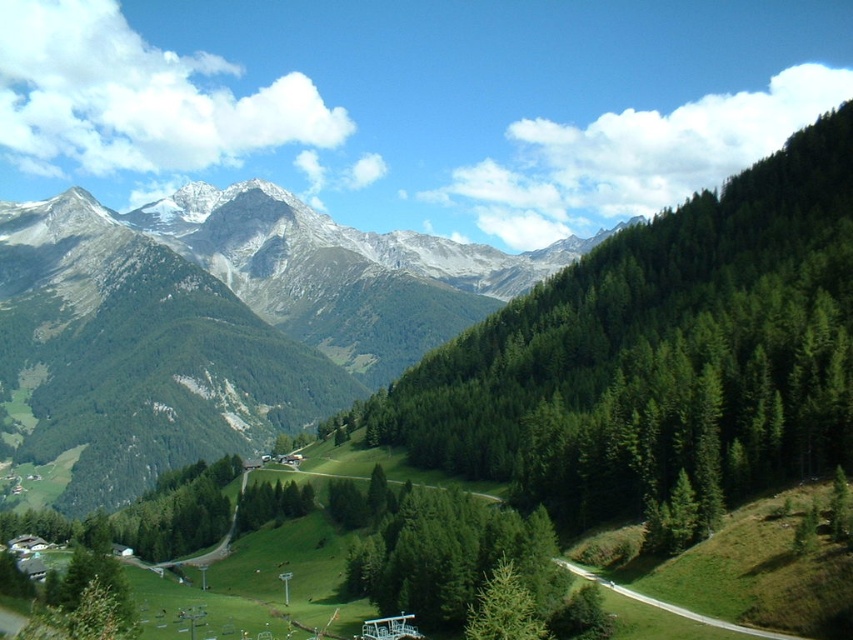
Between green matte tree at center and green grassy path at lower center, which one appears on the right side from the viewer's perspective?

From the viewer's perspective, green grassy path at lower center appears more on the right side.

Can you confirm if green matte tree at center is positioned above green grassy path at lower center?

No.

Is point (531, 616) closer to camera compared to point (701, 620)?

That is False.

The width and height of the screenshot is (853, 640). Find the location of `green matte tree at center`. green matte tree at center is located at coordinates (503, 608).